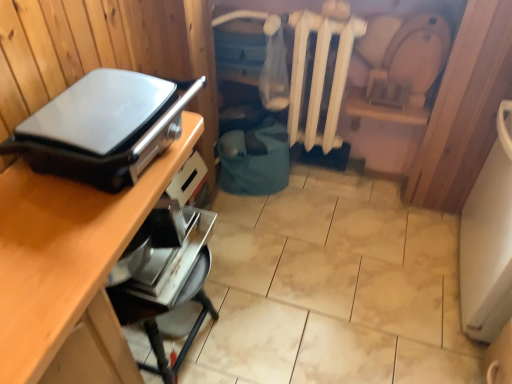
This screenshot has width=512, height=384. What do you see at coordinates (167, 273) in the screenshot?
I see `metallic silver toaster at lower center, marked as the 1th appliance in a bottom-to-top arrangement` at bounding box center [167, 273].

At what (x,y) coordinates should I click in order to perform the action: click on matte black appliance at left, arranged as the first appliance when viewed from the top. Please return your answer as a coordinate pair (x, y). Looking at the image, I should click on (103, 128).

Locate an element on the screen. The image size is (512, 384). white matte radiator at center is located at coordinates [x=319, y=75].

Based on the photo, measure the distance between white matte radiator at center and wooden desk at upper left.

white matte radiator at center is 3.29 feet away from wooden desk at upper left.

Locate an element on the screen. This screenshot has width=512, height=384. radiator above the wooden desk at upper left (from the image's perspective) is located at coordinates (319, 75).

Considering the sizes of objects white matte radiator at center and wooden desk at upper left in the image provided, who is bigger, white matte radiator at center or wooden desk at upper left?

wooden desk at upper left.

Do you think white matte radiator at center is within wooden desk at upper left, or outside of it?

white matte radiator at center is not inside wooden desk at upper left, it's outside.

How distant is white matte radiator at center from metallic silver toaster at lower center, marked as the 1th appliance in a bottom-to-top arrangement?

white matte radiator at center and metallic silver toaster at lower center, marked as the 1th appliance in a bottom-to-top arrangement, are 34.01 inches apart from each other.

From a real-world perspective, is white matte radiator at center beneath metallic silver toaster at lower center, the 2th appliance positioned from the top?

No, from a real-world perspective, white matte radiator at center is not under metallic silver toaster at lower center, the 2th appliance positioned from the top.

Looking at this image, is white matte radiator at center directly adjacent to metallic silver toaster at lower center, marked as the 1th appliance in a bottom-to-top arrangement?

No, white matte radiator at center is not with metallic silver toaster at lower center, marked as the 1th appliance in a bottom-to-top arrangement.

Does white matte radiator at center contain metallic silver toaster at lower center, the 2th appliance positioned from the top?

Actually, metallic silver toaster at lower center, the 2th appliance positioned from the top, is outside white matte radiator at center.

Are matte black appliance at left, arranged as the first appliance when viewed from the top, and wooden desk at upper left beside each other?

No.

Considering the positions of objects matte black appliance at left, arranged as the first appliance when viewed from the top, and wooden desk at upper left in the image provided, who is more to the right, matte black appliance at left, arranged as the first appliance when viewed from the top, or wooden desk at upper left?

matte black appliance at left, arranged as the first appliance when viewed from the top.

From a real-world perspective, is matte black appliance at left, which is the second appliance from bottom to top, located beneath wooden desk at upper left?

Incorrect, from a real-world perspective, matte black appliance at left, which is the second appliance from bottom to top, is higher than wooden desk at upper left.

Find the location of a particular element. The image size is (512, 384). radiator on the right of matte black appliance at left, arranged as the first appliance when viewed from the top is located at coordinates (319, 75).

Is matte black appliance at left, which is the second appliance from bottom to top, a part of white matte radiator at center?

That's incorrect, matte black appliance at left, which is the second appliance from bottom to top, is not inside white matte radiator at center.

Is white matte radiator at center positioned far away from matte black appliance at left, arranged as the first appliance when viewed from the top?

No.

Based on the photo, in the image, is white matte radiator at center on the left side or the right side of matte black appliance at left, which is the second appliance from bottom to top?

Clearly, white matte radiator at center is on the right of matte black appliance at left, which is the second appliance from bottom to top, in the image.

From the image's perspective, is metallic silver toaster at lower center, the 2th appliance positioned from the top, on top of matte black appliance at left, which is the second appliance from bottom to top?

Incorrect, from the image's perspective, metallic silver toaster at lower center, the 2th appliance positioned from the top, is lower than matte black appliance at left, which is the second appliance from bottom to top.

From a real-world perspective, which is physically above, metallic silver toaster at lower center, marked as the 1th appliance in a bottom-to-top arrangement, or matte black appliance at left, which is the second appliance from bottom to top?

matte black appliance at left, which is the second appliance from bottom to top, from a real-world perspective.

Between metallic silver toaster at lower center, the 2th appliance positioned from the top, and matte black appliance at left, which is the second appliance from bottom to top, which one has larger width?

matte black appliance at left, which is the second appliance from bottom to top.

From a real-world perspective, is matte black appliance at left, which is the second appliance from bottom to top, positioned above or below metallic silver toaster at lower center, marked as the 1th appliance in a bottom-to-top arrangement?

Clearly, from a real-world perspective, matte black appliance at left, which is the second appliance from bottom to top, is above metallic silver toaster at lower center, marked as the 1th appliance in a bottom-to-top arrangement.

Considering the relative positions of matte black appliance at left, arranged as the first appliance when viewed from the top, and metallic silver toaster at lower center, the 2th appliance positioned from the top, in the image provided, is matte black appliance at left, arranged as the first appliance when viewed from the top, to the left of metallic silver toaster at lower center, the 2th appliance positioned from the top, from the viewer's perspective?

Yes.

Is matte black appliance at left, which is the second appliance from bottom to top, inside the boundaries of metallic silver toaster at lower center, marked as the 1th appliance in a bottom-to-top arrangement, or outside?

matte black appliance at left, which is the second appliance from bottom to top, cannot be found inside metallic silver toaster at lower center, marked as the 1th appliance in a bottom-to-top arrangement.

In terms of width, does wooden desk at upper left look wider or thinner when compared to metallic silver toaster at lower center, marked as the 1th appliance in a bottom-to-top arrangement?

In the image, wooden desk at upper left appears to be wider than metallic silver toaster at lower center, marked as the 1th appliance in a bottom-to-top arrangement.

Can you confirm if wooden desk at upper left is positioned to the left of metallic silver toaster at lower center, marked as the 1th appliance in a bottom-to-top arrangement?

Correct, you'll find wooden desk at upper left to the left of metallic silver toaster at lower center, marked as the 1th appliance in a bottom-to-top arrangement.

Could you tell me if wooden desk at upper left is turned towards metallic silver toaster at lower center, the 2th appliance positioned from the top?

Yes.

Is wooden desk at upper left positioned far away from metallic silver toaster at lower center, marked as the 1th appliance in a bottom-to-top arrangement?

They are positioned close to each other.

What are the coordinates of `radiator located above the wooden desk at upper left (from a real-world perspective)` in the screenshot? It's located at (319, 75).

Locate an element on the screen. The height and width of the screenshot is (384, 512). appliance below the white matte radiator at center (from a real-world perspective) is located at coordinates (x=167, y=273).

Looking at this image, from the image, which object appears to be nearer to wooden desk at upper left, white matte radiator at center or matte black appliance at left, which is the second appliance from bottom to top?

matte black appliance at left, which is the second appliance from bottom to top.

Estimate the real-world distances between objects in this image. Which object is closer to metallic silver toaster at lower center, the 2th appliance positioned from the top, matte black appliance at left, which is the second appliance from bottom to top, or white matte radiator at center?

matte black appliance at left, which is the second appliance from bottom to top, is closer to metallic silver toaster at lower center, the 2th appliance positioned from the top.

From the image, which object appears to be farther from metallic silver toaster at lower center, the 2th appliance positioned from the top, white matte radiator at center or wooden desk at upper left?

Among the two, white matte radiator at center is located further to metallic silver toaster at lower center, the 2th appliance positioned from the top.

Considering their positions, is metallic silver toaster at lower center, marked as the 1th appliance in a bottom-to-top arrangement, positioned closer to wooden desk at upper left than white matte radiator at center?

metallic silver toaster at lower center, marked as the 1th appliance in a bottom-to-top arrangement, lies closer to wooden desk at upper left than the other object.

Which object lies further to the anchor point white matte radiator at center, wooden desk at upper left or matte black appliance at left, arranged as the first appliance when viewed from the top?

Based on the image, wooden desk at upper left appears to be further to white matte radiator at center.

Considering their positions, is matte black appliance at left, arranged as the first appliance when viewed from the top, positioned further to white matte radiator at center than wooden desk at upper left?

wooden desk at upper left is positioned further to the anchor white matte radiator at center.

Based on their spatial positions, is matte black appliance at left, arranged as the first appliance when viewed from the top, or metallic silver toaster at lower center, marked as the 1th appliance in a bottom-to-top arrangement, further from wooden desk at upper left?

metallic silver toaster at lower center, marked as the 1th appliance in a bottom-to-top arrangement, is further to wooden desk at upper left.

Estimate the real-world distances between objects in this image. Which object is closer to wooden desk at upper left, matte black appliance at left, arranged as the first appliance when viewed from the top, or white matte radiator at center?

The object closer to wooden desk at upper left is matte black appliance at left, arranged as the first appliance when viewed from the top.

What are the coordinates of `appliance located between matte black appliance at left, which is the second appliance from bottom to top, and white matte radiator at center in the depth direction` in the screenshot? It's located at (167, 273).

I want to click on appliance between matte black appliance at left, which is the second appliance from bottom to top, and wooden desk at upper left in the up-down direction, so click(x=167, y=273).